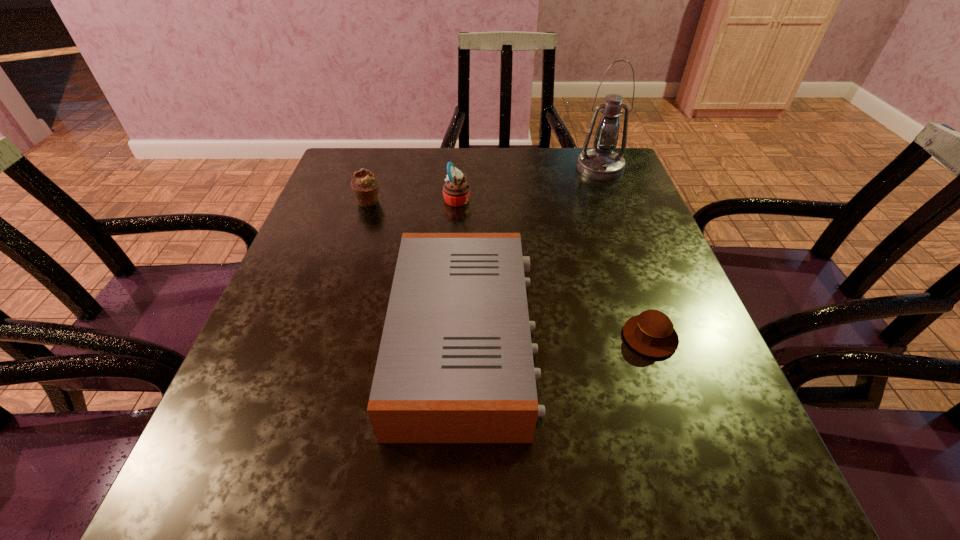
This screenshot has width=960, height=540. In order to click on vacant space located 0.070m on the control panel of the radio receiver in this screenshot , I will do `click(574, 340)`.

The image size is (960, 540). I want to click on free space located 0.160m on the back of the shortest object, so click(623, 260).

Where is `oil lamp present at the far edge`? This screenshot has width=960, height=540. oil lamp present at the far edge is located at coordinates (602, 163).

Identify the location of object located in the left edge section of the desktop. (365, 185).

Image resolution: width=960 pixels, height=540 pixels. Identify the location of oil lamp located in the right edge section of the desktop. (602, 163).

You are a GUI agent. You are given a task and a screenshot of the screen. Output one action in this format:
    pyautogui.click(x=<x>, y=<y>)
    Task: Click on the muffin that is at the right edge
    The height and width of the screenshot is (540, 960).
    Given the screenshot: What is the action you would take?
    pyautogui.click(x=651, y=333)

The image size is (960, 540). In order to click on object at the far left corner in this screenshot , I will do pyautogui.click(x=365, y=185).

At what (x,y) coordinates should I click in order to perform the action: click on object located at the far right corner. Please return your answer as a coordinate pair (x, y). This screenshot has height=540, width=960. Looking at the image, I should click on (602, 163).

Identify the location of free region at the far edge. (431, 192).

Where is `vacant space at the near edge of the desktop`? The image size is (960, 540). vacant space at the near edge of the desktop is located at coordinates (302, 503).